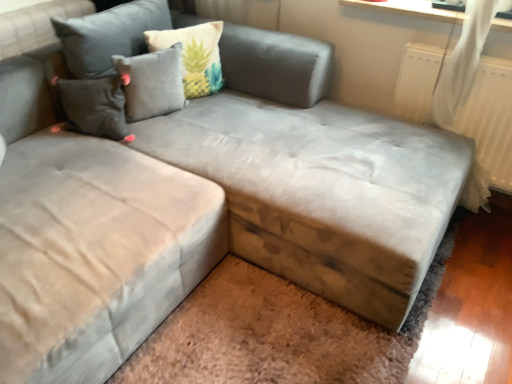
Question: In terms of width, does brown wood storage at lower right look wider or thinner when compared to gray fabric pillow at upper center, which is the first pillow in left-to-right order?

Choices:
 (A) thin
 (B) wide

Answer: (B)

Question: Is point (310, 309) closer or farther from the camera than point (153, 97)?

Choices:
 (A) closer
 (B) farther

Answer: (A)

Question: Estimate the real-world distances between objects in this image. Which object is closer to the brown wood storage at lower right?

Choices:
 (A) beige fabric pillow at upper center, acting as the 1th pillow starting from the right
 (B) gray fabric pillow at upper center, which is the first pillow in left-to-right order

Answer: (B)

Question: Based on their relative distances, which object is nearer to the beige fabric pillow at upper center, acting as the 1th pillow starting from the right?

Choices:
 (A) gray fabric pillow at upper center, which is the 2th pillow from right to left
 (B) brown wood storage at lower right

Answer: (A)